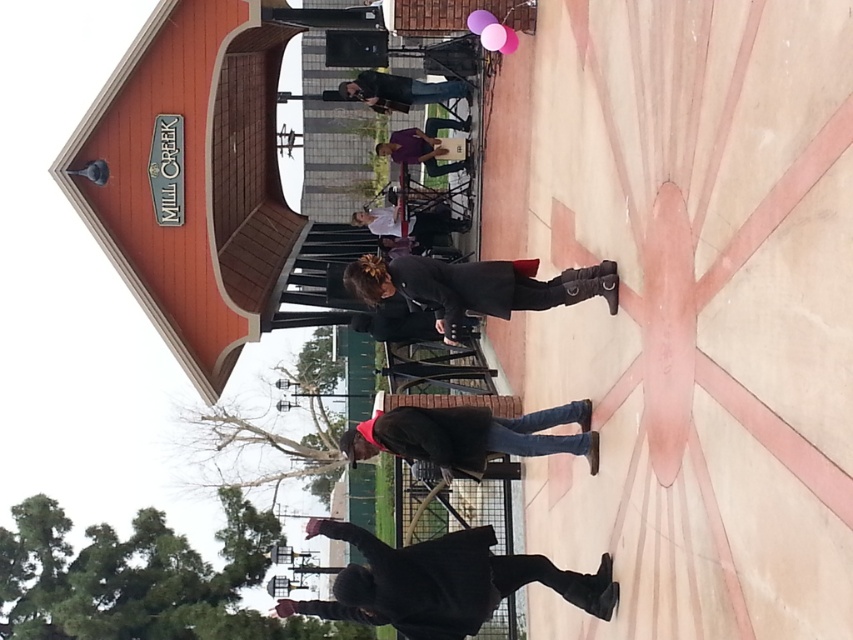
Question: Is black matte skateboard at center bigger than black leather boots at center?

Choices:
 (A) yes
 (B) no

Answer: (B)

Question: Does black matte skateboard at center appear on the left side of black leather boots at center?

Choices:
 (A) no
 (B) yes

Answer: (A)

Question: Which point is closer to the camera?

Choices:
 (A) black leather boots at center
 (B) black matte skateboard at center

Answer: (B)

Question: Among these objects, which one is farthest from the camera?

Choices:
 (A) black leather jacket at center
 (B) black leather boots at center
 (C) black matte skateboard at center
 (D) matte black jacket at center

Answer: (D)

Question: Which object appears farthest from the camera in this image?

Choices:
 (A) black leather jacket at center
 (B) black leather boots at center

Answer: (A)

Question: Where is black matte skateboard at center located in relation to matte black jacket at center in the image?

Choices:
 (A) right
 (B) left

Answer: (A)